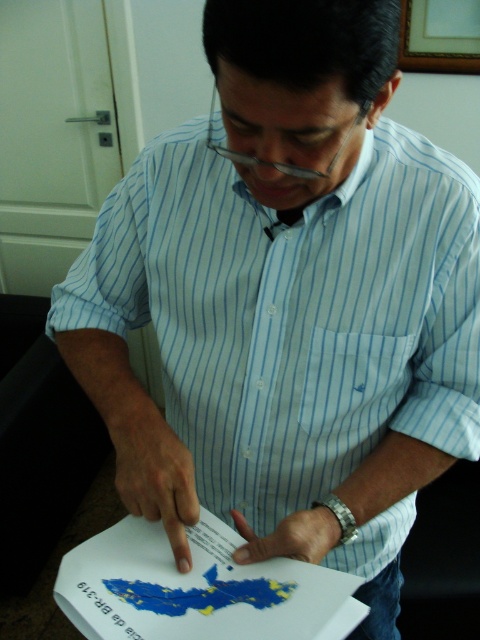
Based on the photo, who is higher up, blue paper map at lower center or clear plastic glasses at center?

clear plastic glasses at center

Can you confirm if blue paper map at lower center is positioned to the left of clear plastic glasses at center?

Yes, blue paper map at lower center is to the left of clear plastic glasses at center.

Measure the distance between point (216, 586) and camera.

Point (216, 586) and camera are 26.00 inches apart from each other.

In order to click on blue paper map at lower center in this screenshot , I will do `click(199, 588)`.